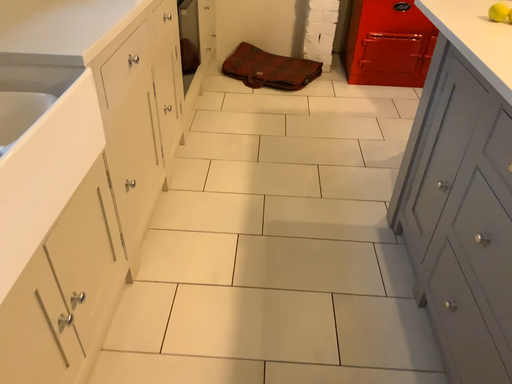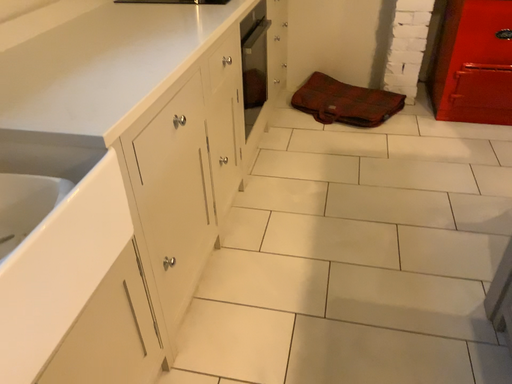
Question: How did the camera likely rotate when shooting the video?

Choices:
 (A) rotated right
 (B) rotated left

Answer: (B)